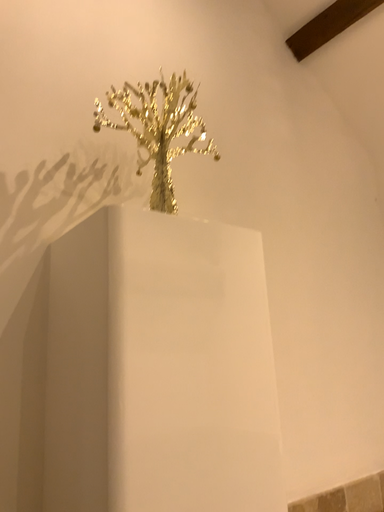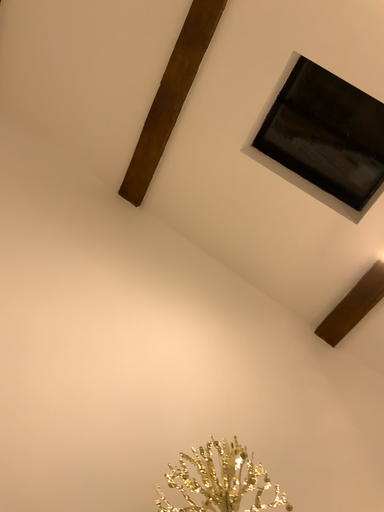
Question: Which way did the camera rotate in the video?

Choices:
 (A) rotated downward
 (B) rotated upward

Answer: (B)